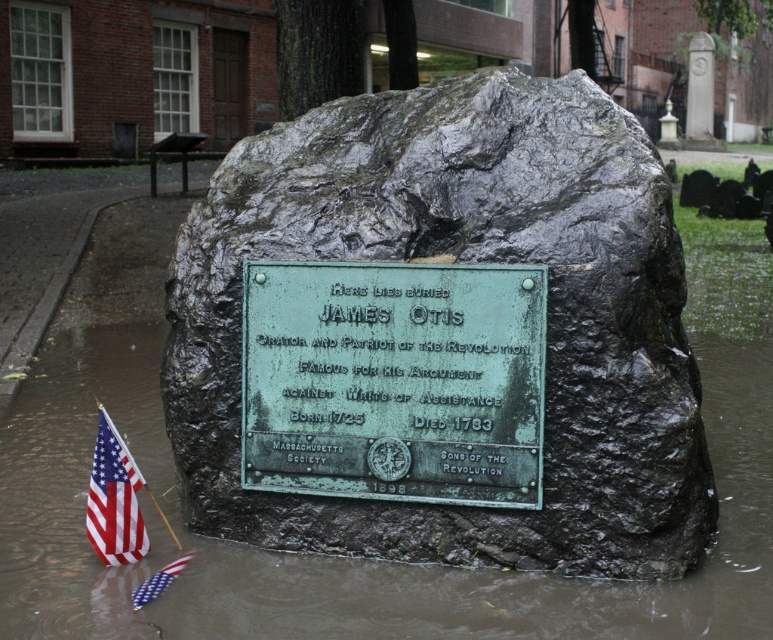
Question: Is green patina stone boulder at center below green patina plaque at center?

Choices:
 (A) no
 (B) yes

Answer: (A)

Question: Which of the following is the closest to the observer?

Choices:
 (A) green patina plaque at center
 (B) american flag fabric at lower left
 (C) red fabric flag at lower left

Answer: (A)

Question: Among these objects, which one is nearest to the camera?

Choices:
 (A) american flag fabric at lower left
 (B) green patina stone boulder at center

Answer: (B)

Question: Is green patina stone boulder at center further to the viewer compared to green patina plaque at center?

Choices:
 (A) no
 (B) yes

Answer: (A)

Question: Does green patina plaque at center appear on the right side of red fabric flag at lower left?

Choices:
 (A) no
 (B) yes

Answer: (B)

Question: Which object is the farthest from the american flag fabric at lower left?

Choices:
 (A) red fabric flag at lower left
 (B) green patina stone boulder at center

Answer: (B)